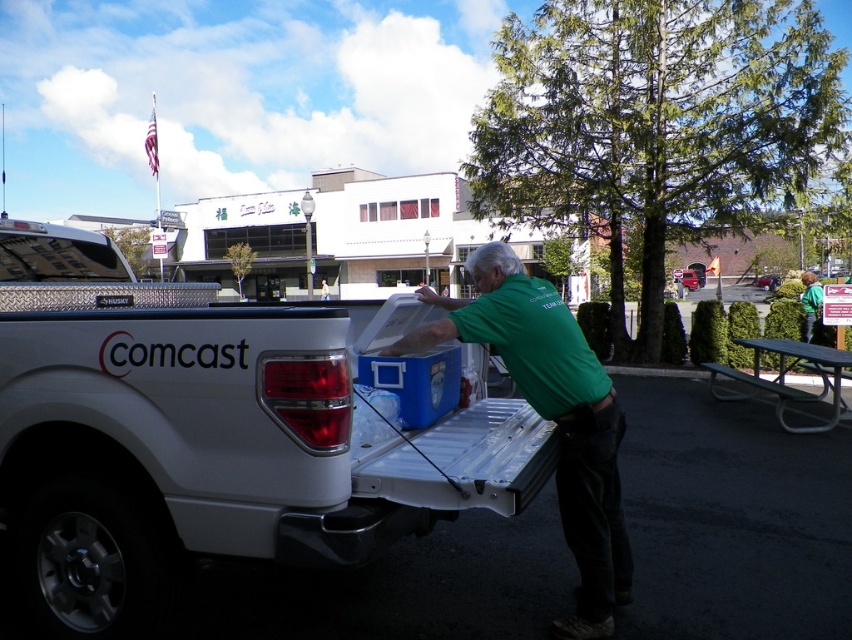
Question: Which point is closer to the camera?

Choices:
 (A) blue plastic cooler at center
 (B) green fabric shirt at center
 (C) metallic gray picnic table at right

Answer: (A)

Question: Observing the image, what is the correct spatial positioning of blue plastic cooler at center in reference to green fabric shirt at center?

Choices:
 (A) left
 (B) right

Answer: (A)

Question: Does green fabric shirt at center appear on the left side of metallic gray picnic table at right?

Choices:
 (A) no
 (B) yes

Answer: (B)

Question: Is blue plastic cooler at center above green fabric shirt at center?

Choices:
 (A) yes
 (B) no

Answer: (B)

Question: Which of the following is the closest to the observer?

Choices:
 (A) click(16, 403)
 (B) click(625, 584)

Answer: (A)

Question: Which point is farther to the camera?

Choices:
 (A) (614, 416)
 (B) (545, 442)

Answer: (B)